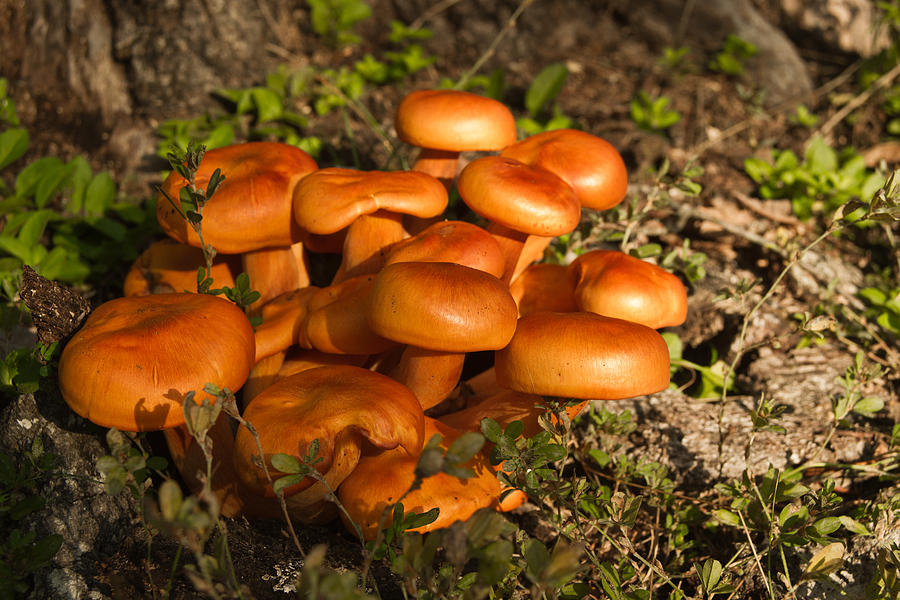
Locate an element on the screen. The width and height of the screenshot is (900, 600). plant is located at coordinates (347, 247).